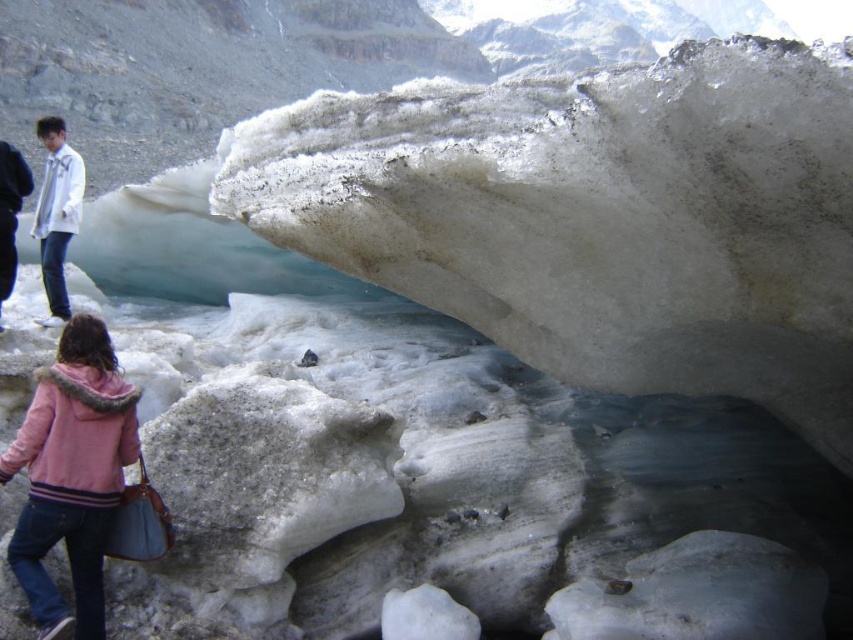
Is translucent ice at center wider than white matte jacket at upper left?

In fact, translucent ice at center might be narrower than white matte jacket at upper left.

Can you confirm if translucent ice at center is positioned to the right of white matte jacket at upper left?

Indeed, translucent ice at center is positioned on the right side of white matte jacket at upper left.

At what (x,y) coordinates should I click in order to perform the action: click on translucent ice at center. Please return your answer as a coordinate pair (x, y). This screenshot has width=853, height=640. Looking at the image, I should click on (596, 218).

Can you confirm if pink fleece jacket at lower left is smaller than white matte jacket at upper left?

Correct, pink fleece jacket at lower left occupies less space than white matte jacket at upper left.

Is pink fleece jacket at lower left below white matte jacket at upper left?

Yes, pink fleece jacket at lower left is below white matte jacket at upper left.

What do you see at coordinates (71, 474) in the screenshot?
I see `pink fleece jacket at lower left` at bounding box center [71, 474].

The width and height of the screenshot is (853, 640). In order to click on pink fleece jacket at lower left in this screenshot , I will do `click(71, 474)`.

Which is above, translucent ice at center or pink fleece jacket at lower left?

translucent ice at center is higher up.

Is translucent ice at center to the left of pink fleece jacket at lower left from the viewer's perspective?

In fact, translucent ice at center is to the right of pink fleece jacket at lower left.

Between point (741, 108) and point (126, 385), which one is positioned behind?

Point (126, 385)

In order to click on translucent ice at center in this screenshot , I will do coord(596,218).